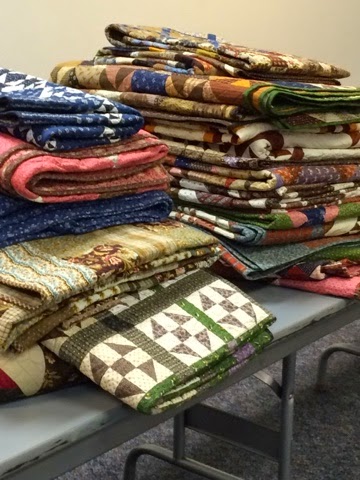
This screenshot has width=360, height=480. What are the coordinates of `metal side of tabletop` in the screenshot? It's located at (71, 454).